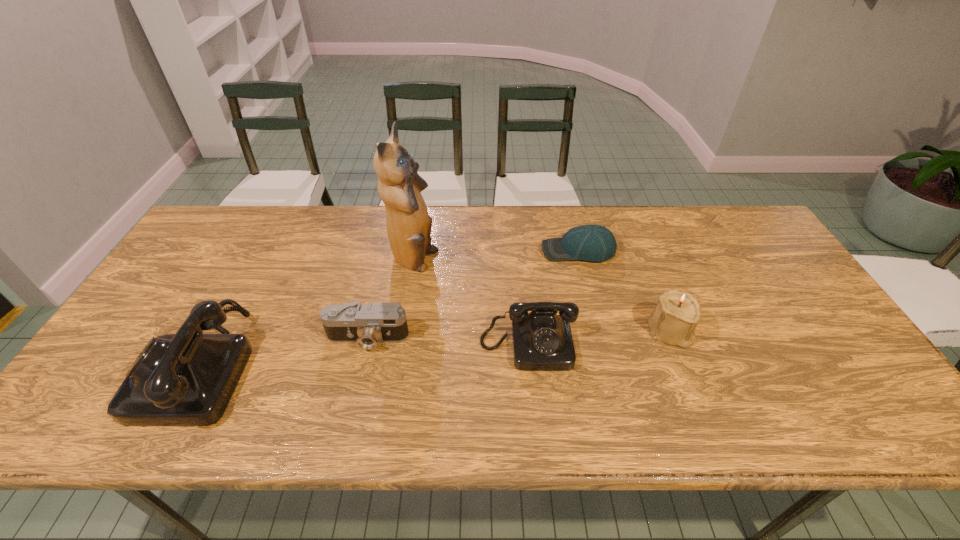
This screenshot has height=540, width=960. In order to click on the fifth shortest object in this screenshot , I will do `click(185, 379)`.

Where is `the left telephone`? the left telephone is located at coordinates (185, 379).

Where is `the third shortest object`? The width and height of the screenshot is (960, 540). the third shortest object is located at coordinates (542, 340).

The image size is (960, 540). Identify the location of the shorter telephone. (542, 340).

The image size is (960, 540). Find the location of `cat`. cat is located at coordinates (399, 185).

The image size is (960, 540). Find the location of `baseball cap`. baseball cap is located at coordinates (595, 243).

In order to click on camera in this screenshot , I will do `click(368, 323)`.

Locate an element on the screen. Image resolution: width=960 pixels, height=540 pixels. candle_holder is located at coordinates (677, 313).

Find the location of a particular element. the rightmost object is located at coordinates (677, 313).

Find the location of a particular element. The width and height of the screenshot is (960, 540). vacant space located 0.090m on the dial of the left telephone is located at coordinates (114, 364).